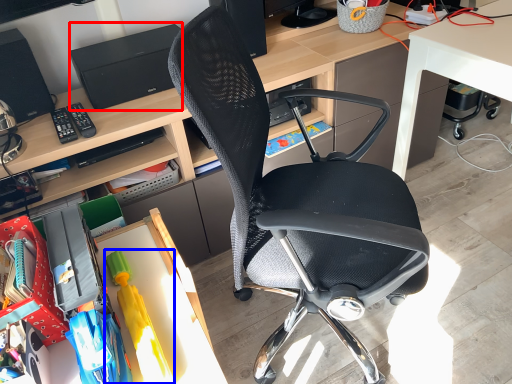
Question: Which point is closer to the camera, printer (highlighted by a red box) or toy (highlighted by a blue box)?

Choices:
 (A) printer
 (B) toy

Answer: (B)